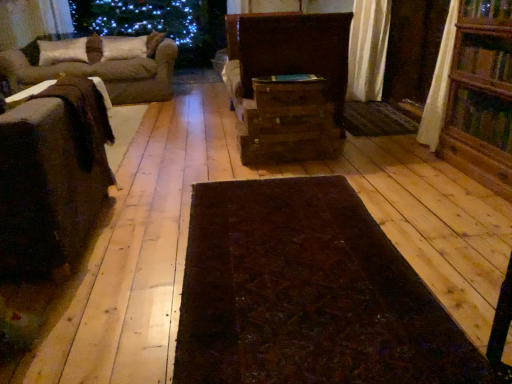
Locate an element on the screen. Image resolution: width=512 pixels, height=384 pixels. vacant space in between wooden bookshelf at right and dark brown fabric couch at left, the 1th furniture positioned from the front is located at coordinates (289, 204).